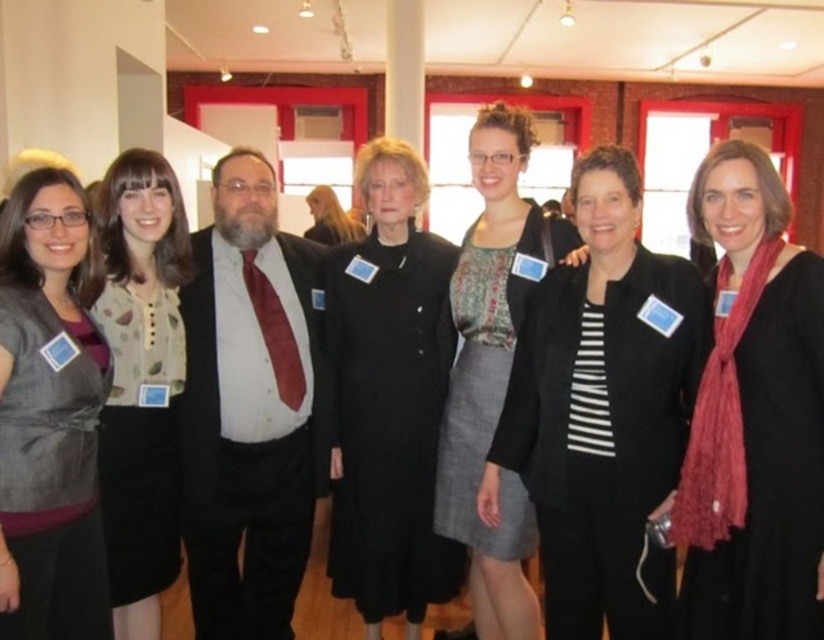
You are standing in the gallery and want to move from the point closer to you to the point further away. Which path should you take? The path goes from the point at [305,369] to the point at [509,618]. Is this the correct path?

Yes, the path from point [305,369] to point [509,618] is correct because point [305,369] is closer to you, and point [509,618] is further away, so moving from the closer to the further point follows this path.

Based on the photo, you are standing in the gallery and want to take a photo of the matte white shirt at center without anyone blocking it. Since the shirt is 2.42 meters away, how far back should you step to ensure a clear view?

The matte white shirt at center is 2.42 meters from the viewer. To ensure a clear view without obstruction, you should step back approximately 2.42 meters to frame the shirt properly while avoiding any people in front.